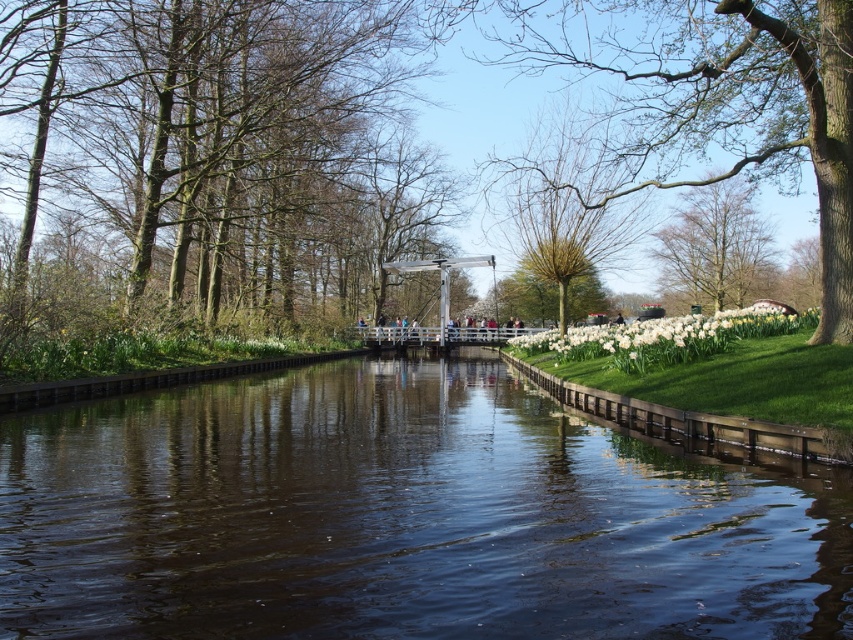
Question: Can you confirm if brown bark tree at left is positioned below bare branches at upper center?

Choices:
 (A) no
 (B) yes

Answer: (A)

Question: Which point is closer to the camera?

Choices:
 (A) (397, 230)
 (B) (581, 346)
 (C) (840, 509)

Answer: (C)

Question: Which point is closer to the camera?

Choices:
 (A) (183, 45)
 (B) (767, 268)
 (C) (758, 564)
 (D) (817, 312)

Answer: (C)

Question: Which is farther from the brown bark tree at left?

Choices:
 (A) dark brown water at center
 (B) bare branches at upper center

Answer: (A)

Question: Can you confirm if dark brown water at center is positioned to the right of white glossy daffodil at right?

Choices:
 (A) yes
 (B) no

Answer: (B)

Question: Does dark brown water at center appear under white glossy daffodil at right?

Choices:
 (A) yes
 (B) no

Answer: (A)